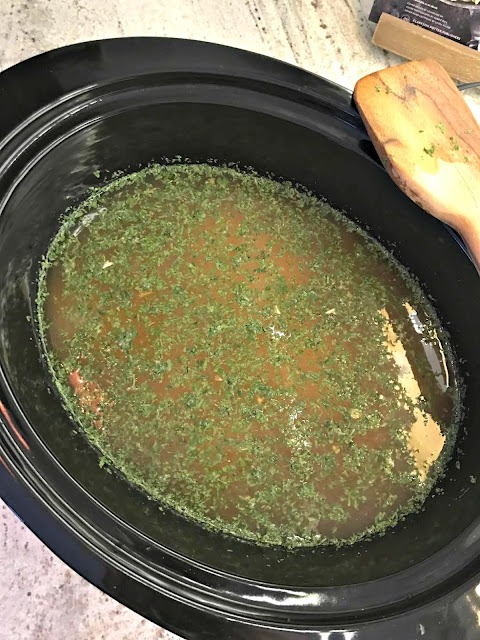
Find the location of a particular element. This screenshot has width=480, height=640. tan and brown counter is located at coordinates (71, 610), (303, 422).